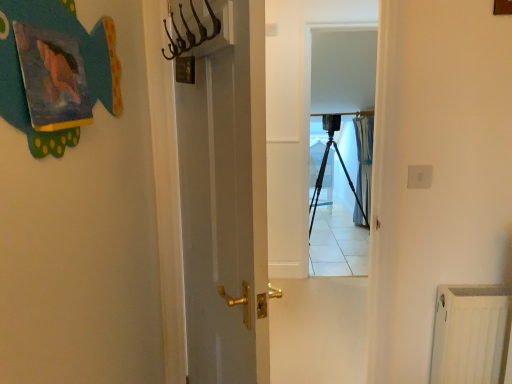
At what (x,y) coordinates should I click in order to perform the action: click on white glossy screen door at center, acting as the first screen door starting from the left. Please return your answer as a coordinate pair (x, y). This screenshot has height=384, width=512. Looking at the image, I should click on (305, 207).

Describe the element at coordinates (323, 177) in the screenshot. I see `black matte tripod at center` at that location.

Identify the location of white glossy screen door at center, the second screen door viewed from the back. (305, 207).

Looking at this image, from a real-world perspective, is transparent plastic screen door at center, placed as the 2th screen door when sorted from left to right, physically above blue sheer curtain at center?

Yes, from a real-world perspective, transparent plastic screen door at center, placed as the 2th screen door when sorted from left to right, is above blue sheer curtain at center.

Is transparent plastic screen door at center, placed as the 2th screen door when sorted from left to right, facing towards blue sheer curtain at center?

No, transparent plastic screen door at center, placed as the 2th screen door when sorted from left to right, is not oriented towards blue sheer curtain at center.

Which object is positioned more to the right, transparent plastic screen door at center, which is the first screen door in right-to-left order, or blue sheer curtain at center?

blue sheer curtain at center is more to the right.

Is point (481, 331) closer or farther from the camera than point (320, 69)?

Point (481, 331).

Considering the sizes of white textured radiator at lower right and transparent plastic screen door at center, which is the first screen door in right-to-left order, in the image, is white textured radiator at lower right wider or thinner than transparent plastic screen door at center, which is the first screen door in right-to-left order,?

Considering their sizes, white textured radiator at lower right looks broader than transparent plastic screen door at center, which is the first screen door in right-to-left order.

Is white textured radiator at lower right not close to transparent plastic screen door at center, placed as the 2th screen door when sorted from left to right?

Indeed, white textured radiator at lower right is not near transparent plastic screen door at center, placed as the 2th screen door when sorted from left to right.

Locate an element on the screen. the 2nd screen door above the white textured radiator at lower right (from the image's perspective) is located at coordinates (343, 98).

Is white glossy screen door at center, which is the 2th screen door from right to left, positioned in front of blue sheer curtain at center?

Yes, white glossy screen door at center, which is the 2th screen door from right to left, is closer to the camera.

From the image's perspective, is white glossy screen door at center, acting as the first screen door starting from the left, over blue sheer curtain at center?

Incorrect, from the image's perspective, white glossy screen door at center, acting as the first screen door starting from the left, is lower than blue sheer curtain at center.

From a real-world perspective, who is located higher, white glossy screen door at center, acting as the first screen door starting from the left, or blue sheer curtain at center?

white glossy screen door at center, acting as the first screen door starting from the left, is physically above.

Considering the relative positions of white glossy screen door at center, which is the 2th screen door from right to left, and blue sheer curtain at center in the image provided, is white glossy screen door at center, which is the 2th screen door from right to left, to the right of blue sheer curtain at center from the viewer's perspective?

Incorrect, white glossy screen door at center, which is the 2th screen door from right to left, is not on the right side of blue sheer curtain at center.

Is the surface of black matte tripod at center in direct contact with transparent plastic screen door at center, which is counted as the 2th screen door, starting from the front?

No, black matte tripod at center is not in contact with transparent plastic screen door at center, which is counted as the 2th screen door, starting from the front.

From a real-world perspective, which object stands above the other?

transparent plastic screen door at center, the 1th screen door when ordered from back to front, is physically above.

Between black matte tripod at center and transparent plastic screen door at center, placed as the 2th screen door when sorted from left to right, which one appears on the left side from the viewer's perspective?

From the viewer's perspective, transparent plastic screen door at center, placed as the 2th screen door when sorted from left to right, appears more on the left side.

Can you confirm if black matte tripod at center is shorter than transparent plastic screen door at center, the 1th screen door when ordered from back to front?

Indeed, black matte tripod at center has a lesser height compared to transparent plastic screen door at center, the 1th screen door when ordered from back to front.

Considering the sizes of transparent plastic screen door at center, the 1th screen door when ordered from back to front, and white plastic electric outlet at upper right in the image, is transparent plastic screen door at center, the 1th screen door when ordered from back to front, taller or shorter than white plastic electric outlet at upper right?

Considering their sizes, transparent plastic screen door at center, the 1th screen door when ordered from back to front, has more height than white plastic electric outlet at upper right.

Find the location of a particular element. electric outlet in front of the transparent plastic screen door at center, placed as the 2th screen door when sorted from left to right is located at coordinates (419, 176).

Considering the relative sizes of transparent plastic screen door at center, the 1th screen door when ordered from back to front, and white plastic electric outlet at upper right in the image provided, is transparent plastic screen door at center, the 1th screen door when ordered from back to front, wider than white plastic electric outlet at upper right?

Indeed, transparent plastic screen door at center, the 1th screen door when ordered from back to front, has a greater width compared to white plastic electric outlet at upper right.

Do you think transparent plastic screen door at center, which is counted as the 2th screen door, starting from the front, is within white plastic electric outlet at upper right, or outside of it?

transparent plastic screen door at center, which is counted as the 2th screen door, starting from the front, cannot be found inside white plastic electric outlet at upper right.

Is white plastic electric outlet at upper right positioned with its back to transparent plastic screen door at center, the 1th screen door when ordered from back to front?

Yes, white plastic electric outlet at upper right's orientation is away from transparent plastic screen door at center, the 1th screen door when ordered from back to front.

Between white plastic electric outlet at upper right and transparent plastic screen door at center, the 1th screen door when ordered from back to front, which one has more height?

With more height is transparent plastic screen door at center, the 1th screen door when ordered from back to front.

Considering the relative positions of white plastic electric outlet at upper right and transparent plastic screen door at center, placed as the 2th screen door when sorted from left to right, in the image provided, is white plastic electric outlet at upper right to the right of transparent plastic screen door at center, placed as the 2th screen door when sorted from left to right, from the viewer's perspective?

No.

From a real-world perspective, who is located higher, white plastic electric outlet at upper right or transparent plastic screen door at center, placed as the 2th screen door when sorted from left to right?

white plastic electric outlet at upper right.

Is black matte tripod at center in front of or behind white textured radiator at lower right in the image?

Visually, black matte tripod at center is located behind white textured radiator at lower right.

Do you think black matte tripod at center is within white textured radiator at lower right, or outside of it?

A: black matte tripod at center is spatially situated outside white textured radiator at lower right.

From the image's perspective, which is above, black matte tripod at center or white textured radiator at lower right?

black matte tripod at center.

Is black matte tripod at center wider than white textured radiator at lower right?

Correct, the width of black matte tripod at center exceeds that of white textured radiator at lower right.

The height and width of the screenshot is (384, 512). I want to click on the 1st screen door in front of the blue sheer curtain at center, counting from the anchor's position, so (343, 98).

At what (x,y) coordinates should I click in order to perform the action: click on screen door behind the white textured radiator at lower right. Please return your answer as a coordinate pair (x, y). Image resolution: width=512 pixels, height=384 pixels. Looking at the image, I should click on coord(343,98).

Considering their positions, is transparent plastic screen door at center, placed as the 2th screen door when sorted from left to right, positioned closer to white textured radiator at lower right than black matte tripod at center?

Based on the image, transparent plastic screen door at center, placed as the 2th screen door when sorted from left to right, appears to be nearer to white textured radiator at lower right.

When comparing their distances from blue sheer curtain at center, does transparent plastic screen door at center, which is counted as the 2th screen door, starting from the front, or white textured radiator at lower right seem further?

white textured radiator at lower right is further to blue sheer curtain at center.

From the image, which object appears to be nearer to black matte tripod at center, transparent plastic screen door at center, the 1th screen door when ordered from back to front, or blue sheer curtain at center?

blue sheer curtain at center lies closer to black matte tripod at center than the other object.

When comparing their distances from white textured radiator at lower right, does transparent plastic screen door at center, the 1th screen door when ordered from back to front, or blue sheer curtain at center seem further?

blue sheer curtain at center is positioned further to the anchor white textured radiator at lower right.

Estimate the real-world distances between objects in this image. Which object is further from transparent plastic screen door at center, the 1th screen door when ordered from back to front, black matte tripod at center or white glossy screen door at center, the second screen door viewed from the back?

white glossy screen door at center, the second screen door viewed from the back.

Estimate the real-world distances between objects in this image. Which object is further from white textured radiator at lower right, white glossy screen door at center, the 1th screen door in the front-to-back sequence, or white plastic electric outlet at upper right?

The object further to white textured radiator at lower right is white glossy screen door at center, the 1th screen door in the front-to-back sequence.

Considering their positions, is blue sheer curtain at center positioned closer to transparent plastic screen door at center, the 1th screen door when ordered from back to front, than black matte tripod at center?

The object closer to transparent plastic screen door at center, the 1th screen door when ordered from back to front, is black matte tripod at center.

Based on their spatial positions, is blue sheer curtain at center or transparent plastic screen door at center, which is counted as the 2th screen door, starting from the front, closer to white plastic electric outlet at upper right?

The object closer to white plastic electric outlet at upper right is transparent plastic screen door at center, which is counted as the 2th screen door, starting from the front.

Where is `radiator between white glossy screen door at center, the 1th screen door in the front-to-back sequence, and blue sheer curtain at center in the front-back direction`? The width and height of the screenshot is (512, 384). radiator between white glossy screen door at center, the 1th screen door in the front-to-back sequence, and blue sheer curtain at center in the front-back direction is located at coordinates (x=468, y=333).

This screenshot has width=512, height=384. I want to click on electric outlet between white textured radiator at lower right and blue sheer curtain at center along the z-axis, so click(419, 176).

Where is `electric outlet between white textured radiator at lower right and black matte tripod at center in the front-back direction`? The width and height of the screenshot is (512, 384). electric outlet between white textured radiator at lower right and black matte tripod at center in the front-back direction is located at coordinates (419, 176).

This screenshot has width=512, height=384. In order to click on radiator between white glossy screen door at center, which is the 2th screen door from right to left, and black matte tripod at center, along the z-axis in this screenshot , I will do `click(468, 333)`.